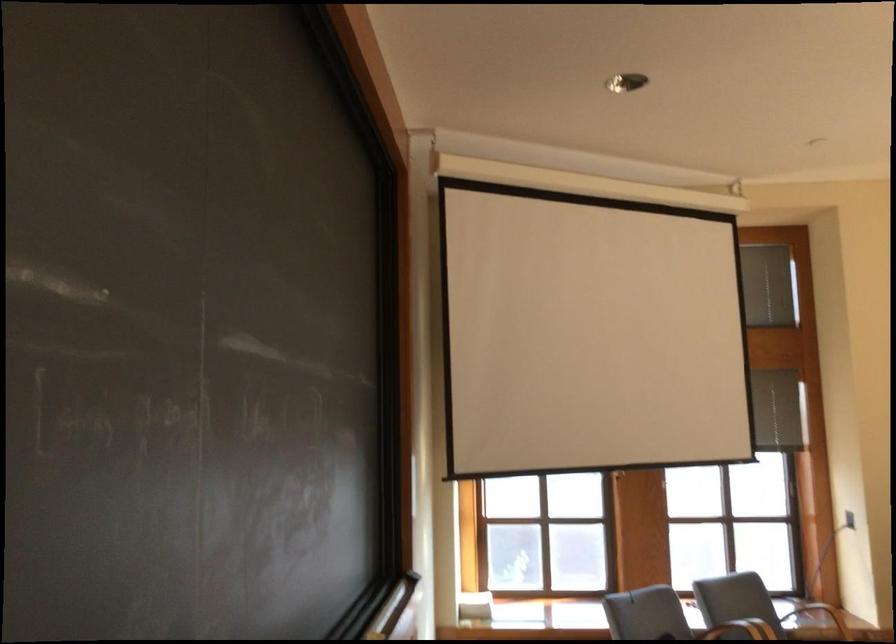
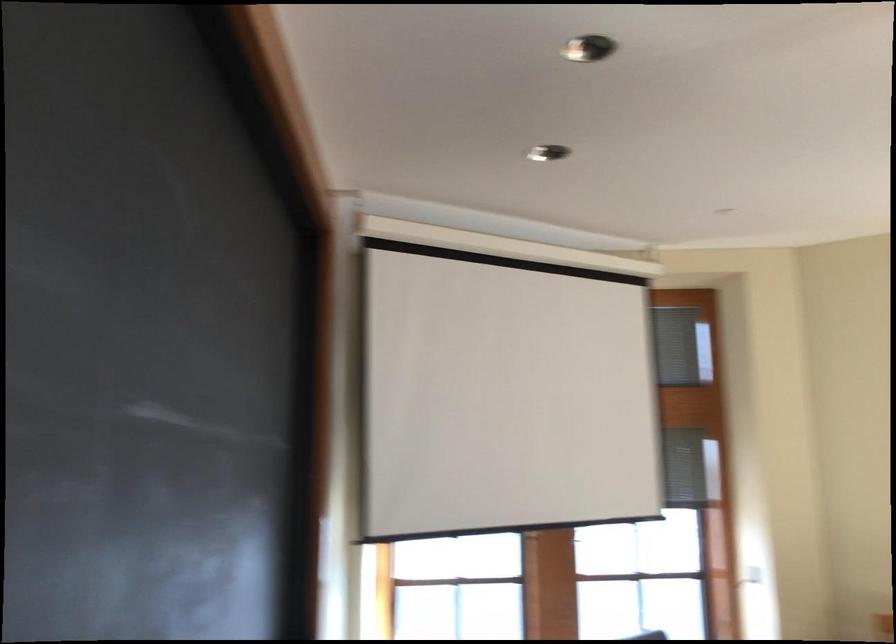
First-person continuous shooting, in which direction is the camera rotating?

The camera rotated toward right-down.